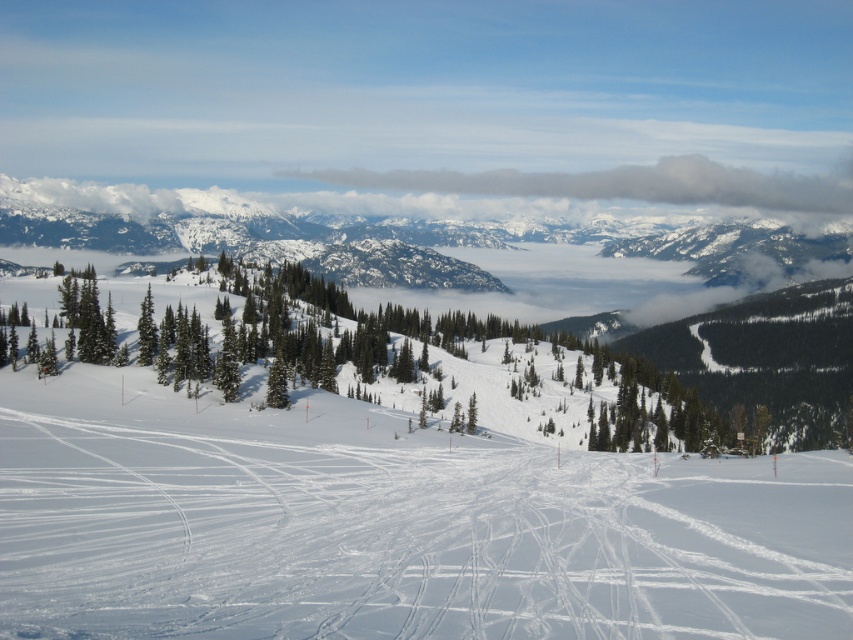
Consider the image. Is white snow-covered mountain at upper center positioned before gray/cloudy cloud at upper center?

Yes, white snow-covered mountain at upper center is in front of gray/cloudy cloud at upper center.

From the picture: Does white snow-covered mountain at upper center appear on the left side of gray/cloudy cloud at upper center?

Correct, you'll find white snow-covered mountain at upper center to the left of gray/cloudy cloud at upper center.

Who is more distant from viewer, [497,232] or [380,179]?

The point [380,179] is behind.

Where is `white snow-covered mountain at upper center`? The height and width of the screenshot is (640, 853). white snow-covered mountain at upper center is located at coordinates (430, 248).